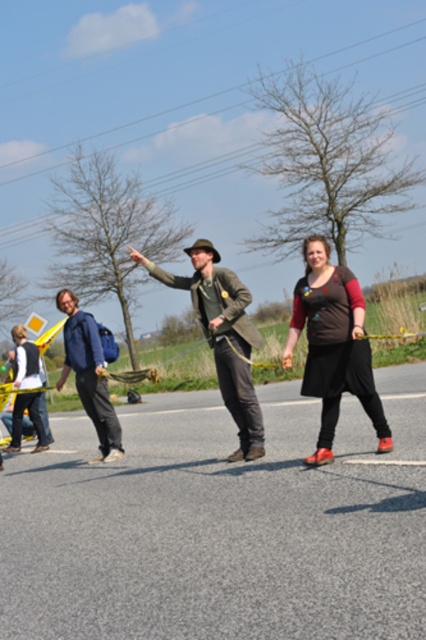
Can you confirm if brown matte dress at center is shorter than green canvas jacket at center?

Indeed, brown matte dress at center has a lesser height compared to green canvas jacket at center.

Is brown matte dress at center positioned before green canvas jacket at center?

Yes, it is in front of green canvas jacket at center.

Is point (296, 332) closer to viewer compared to point (154, 269)?

Yes.

What are the coordinates of `brown matte dress at center` in the screenshot? It's located at (333, 346).

Does brown matte dress at center appear on the right side of blue denim jacket at center?

Indeed, brown matte dress at center is positioned on the right side of blue denim jacket at center.

Is brown matte dress at center smaller than blue denim jacket at center?

No, brown matte dress at center is not smaller than blue denim jacket at center.

Find the location of a particular element. brown matte dress at center is located at coordinates (333, 346).

The image size is (426, 640). I want to click on brown matte dress at center, so click(333, 346).

Between green canvas jacket at center and blue denim jacket at center, which one is positioned lower?

Positioned lower is blue denim jacket at center.

Where is `green canvas jacket at center`? The image size is (426, 640). green canvas jacket at center is located at coordinates (222, 337).

The image size is (426, 640). In order to click on green canvas jacket at center in this screenshot , I will do `click(222, 337)`.